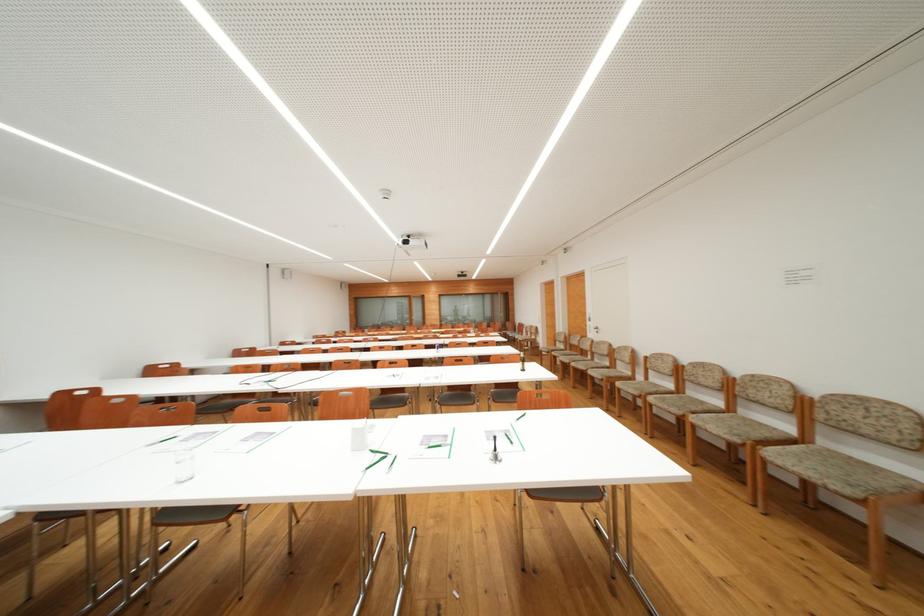
What do you see at coordinates (375, 461) in the screenshot?
I see `a green pen` at bounding box center [375, 461].